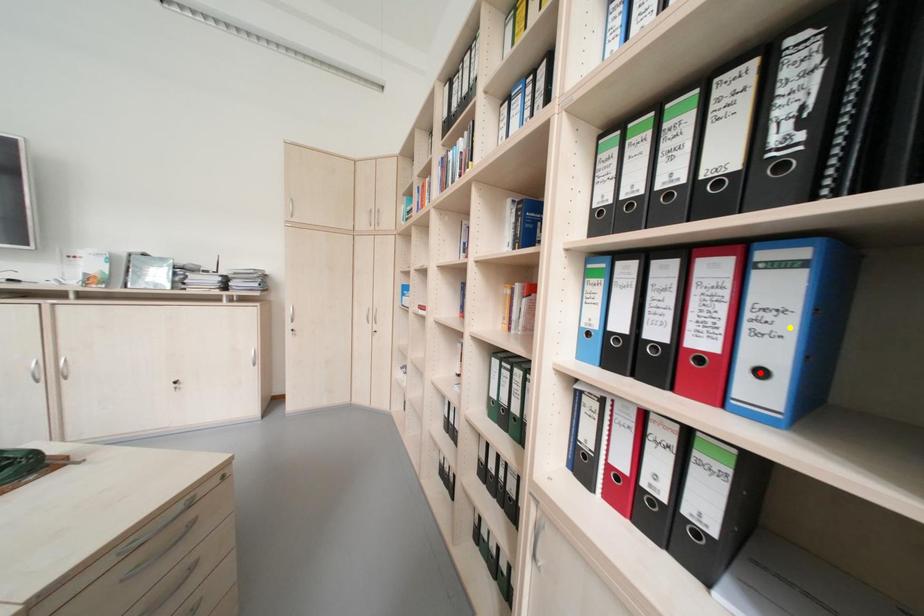
Order these from farthest to nearest:
1. yellow point
2. red point
3. green point

1. red point
2. green point
3. yellow point